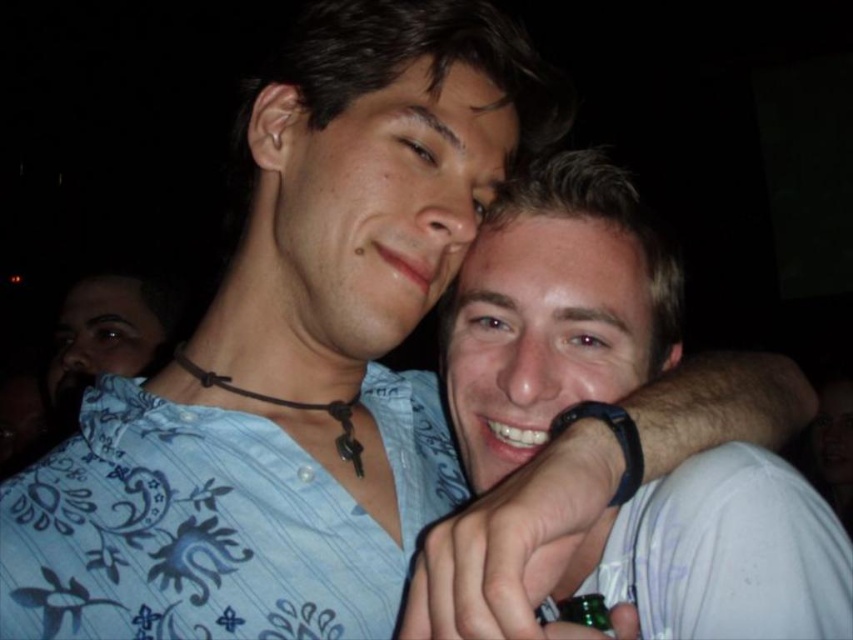
Which is in front, point (657, 582) or point (384, 332)?

Point (657, 582)

Does white matte shirt at center appear on the left side of matte blue shirt at center?

No, white matte shirt at center is not to the left of matte blue shirt at center.

Is point (607, 348) in front of point (410, 113)?

No, (607, 348) is further to viewer.

Where is `white matte shirt at center`? The height and width of the screenshot is (640, 853). white matte shirt at center is located at coordinates (554, 310).

Based on the photo, does matte blue shirt at center appear on the left side of smooth skin face at center?

Yes, matte blue shirt at center is to the left of smooth skin face at center.

Between matte blue shirt at center and smooth skin face at center, which one appears on the right side from the viewer's perspective?

From the viewer's perspective, smooth skin face at center appears more on the right side.

Is point (292, 342) closer to viewer compared to point (608, 298)?

Yes, point (292, 342) is in front of point (608, 298).

Locate an element on the screen. The image size is (853, 640). matte blue shirt at center is located at coordinates (370, 204).

Who is more forward, (260,323) or (61,323)?

Point (260,323) is in front.

Does matte blue shirt at center appear on the left side of matte skin at lower left?

Incorrect, matte blue shirt at center is not on the left side of matte skin at lower left.

Is point (285, 269) closer to viewer compared to point (134, 352)?

Yes, point (285, 269) is in front of point (134, 352).

You are a GUI agent. You are given a task and a screenshot of the screen. Output one action in this format:
    pyautogui.click(x=<x>, y=<y>)
    Task: Click on the matte blue shirt at center
    
    Given the screenshot: What is the action you would take?
    pyautogui.click(x=370, y=204)